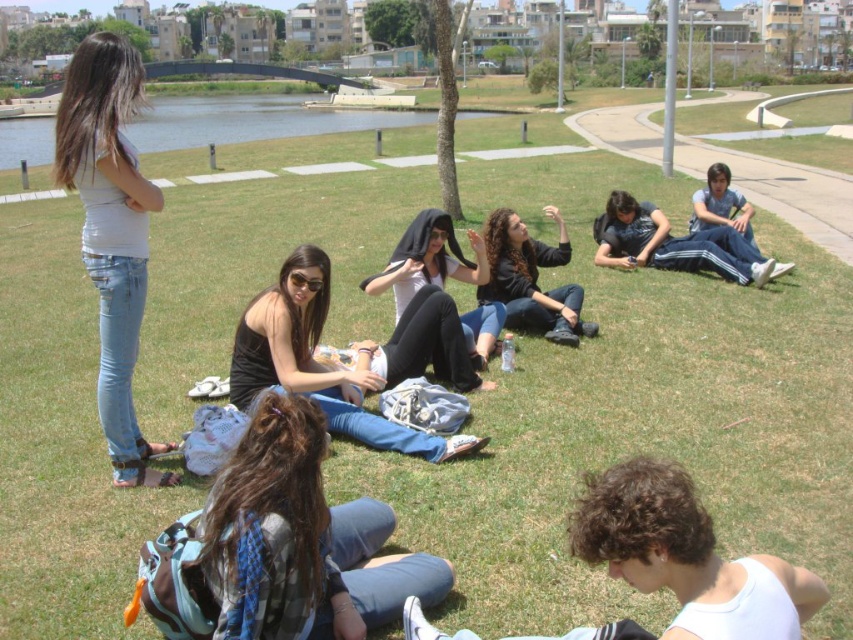
You are a photographer trying to capture a candid shot of the group. You notice the dark brown hair at center and the blue jeans at right. Which object is located lower in the image?

The dark brown hair at center is positioned under the blue jeans at right, so it is located lower in the image.

What is located at the point with coordinates (531, 280) in the image?

The point at coordinates (531, 280) has dark brown hair at center.